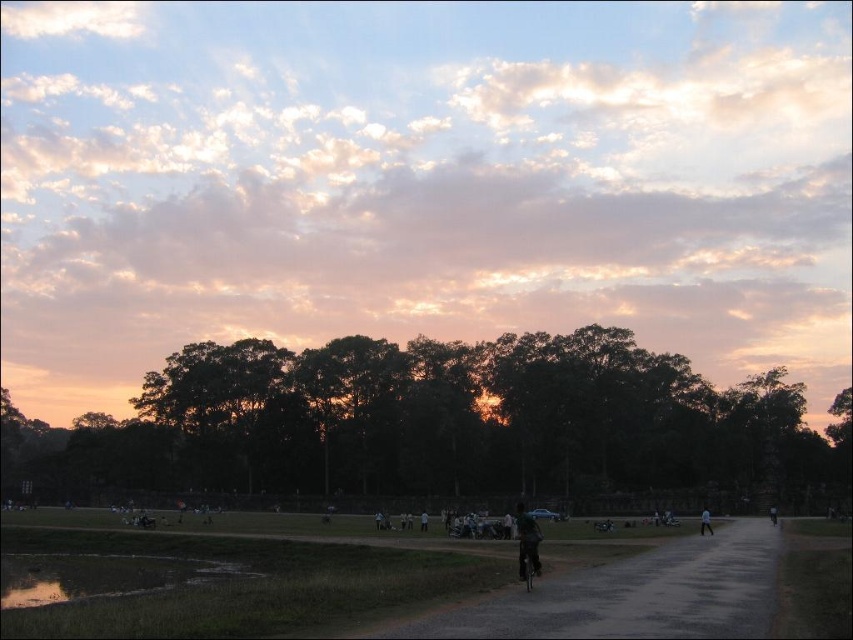
You are standing at the starting point of the pathway and want to reach the point marked as point (537, 554). There is an obstacle at point (364, 481). Can you walk around it by moving closer to the camera side of the obstacle?

Point (364, 481) is further to the camera than point (537, 554). Therefore, the obstacle at point (364, 481) is closer to you, so you can walk around it by moving towards the camera side of the obstacle to reach point (537, 554).

You are standing on the curved pathway in the foreground of the outdoor scene. Looking towards the center of the image, can you see the dark green leafy trees at center? Please explain your line of sight.

Yes, the dark green leafy trees at center are located at point coordinates of approximately (x=440, y=426) in the image, so they should be visible when looking towards the center from the pathway.